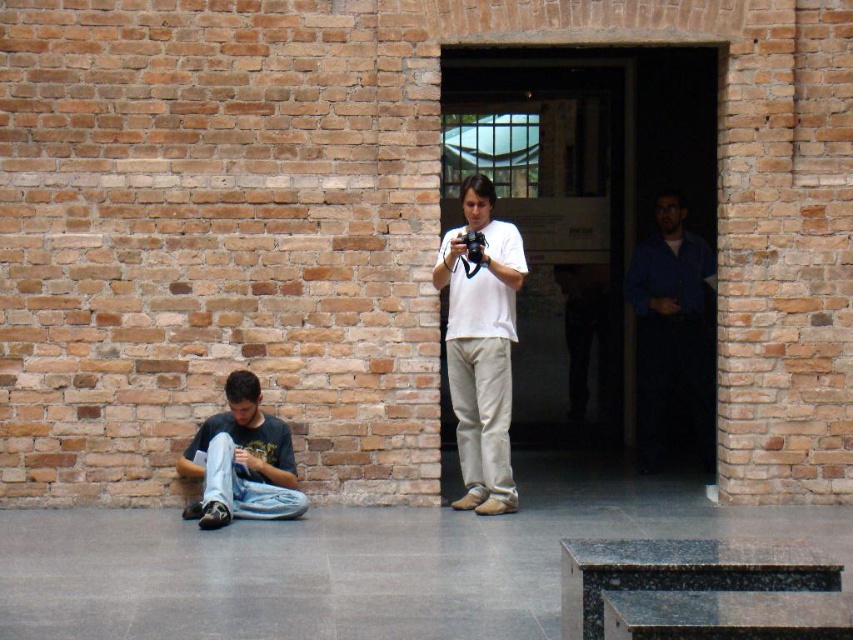
Is point (477, 310) positioned in front of point (660, 364)?

Yes, point (477, 310) is closer to viewer.

What are the coordinates of `white matte shirt at center` in the screenshot? It's located at (480, 346).

From the picture: Who is positioned more to the left, white matte shirt at center or denim jeans at lower left?

denim jeans at lower left

Can you confirm if white matte shirt at center is bigger than denim jeans at lower left?

Yes.

Locate an element on the screen. white matte shirt at center is located at coordinates (480, 346).

From the picture: Does dark blue shirt at right have a greater height compared to denim jeans at lower left?

Yes, dark blue shirt at right is taller than denim jeans at lower left.

Does point (627, 292) come behind point (198, 458)?

Yes, point (627, 292) is behind point (198, 458).

This screenshot has height=640, width=853. I want to click on dark blue shirt at right, so click(x=672, y=333).